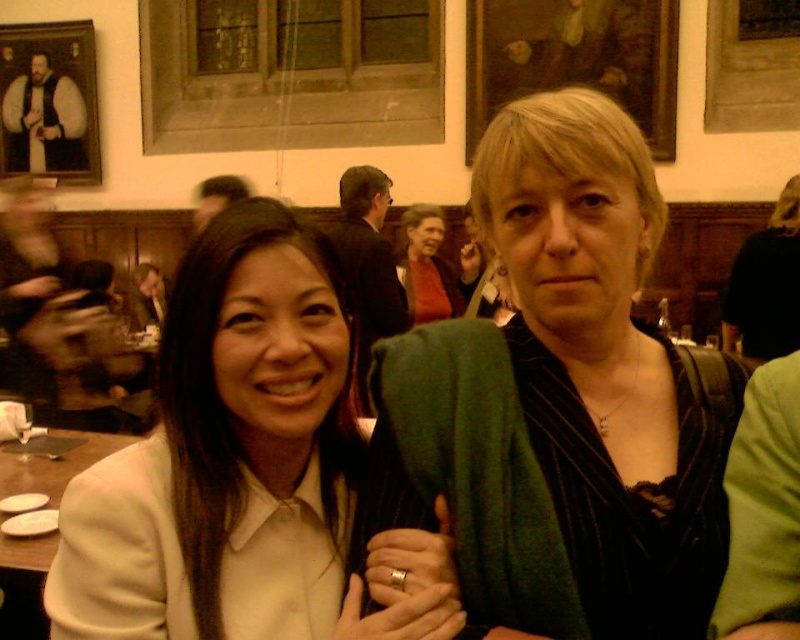
Question: Considering the relative positions of wooden portrait at upper left and white glossy plate at lower left in the image provided, where is wooden portrait at upper left located with respect to white glossy plate at lower left?

Choices:
 (A) right
 (B) left

Answer: (B)

Question: Can you confirm if matte green sweater at center is positioned above matte white blouse at center?

Choices:
 (A) yes
 (B) no

Answer: (A)

Question: Is matte white blouse at center thinner than white glossy plate at lower left?

Choices:
 (A) yes
 (B) no

Answer: (A)

Question: Which of the following is the closest to the observer?

Choices:
 (A) matte green sweater at center
 (B) matte white blouse at center
 (C) white glossy plate at lower left
 (D) wooden portrait at upper left

Answer: (B)

Question: Estimate the real-world distances between objects in this image. Which object is farther from the wooden portrait at upper left?

Choices:
 (A) matte white blouse at center
 (B) matte green sweater at center

Answer: (B)

Question: Which of the following is the closest to the observer?

Choices:
 (A) (4, 464)
 (B) (240, 362)

Answer: (B)